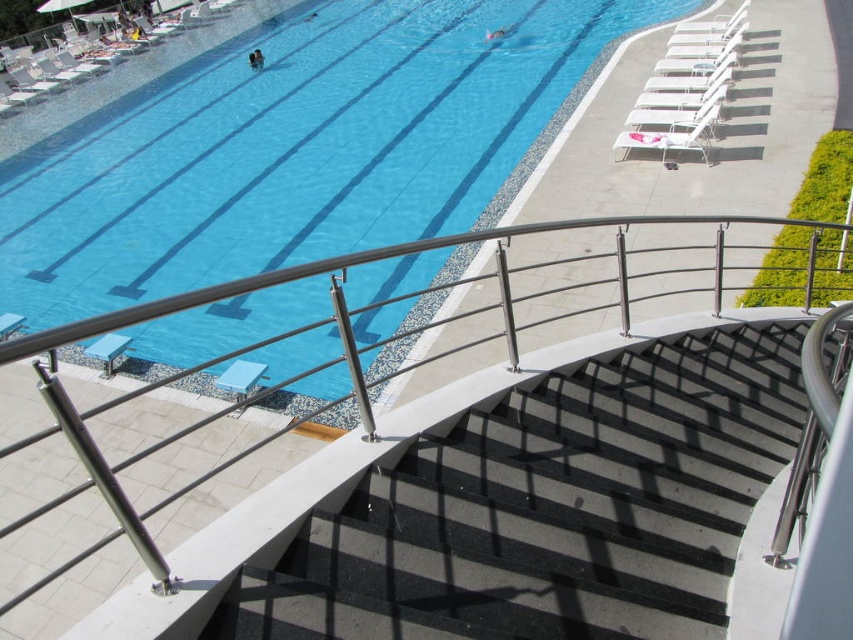
Question: Among these points, which one is farthest from the camera?

Choices:
 (A) (636, 106)
 (B) (358, 168)
 (C) (712, 394)

Answer: (B)

Question: Which point appears closest to the camera in this image?

Choices:
 (A) (637, 116)
 (B) (354, 202)

Answer: (B)

Question: Which of these objects is positioned farthest from the black textured stairs at center?

Choices:
 (A) white plastic lounge chair at upper right
 (B) blue glossy water at upper center

Answer: (A)

Question: Is black textured stairs at center above white plastic lounge chair at upper right?

Choices:
 (A) yes
 (B) no

Answer: (B)

Question: Can you confirm if blue glossy water at upper center is thinner than white plastic lounge chair at upper right?

Choices:
 (A) no
 (B) yes

Answer: (A)

Question: Does black textured stairs at center appear on the left side of white plastic lounge chair at upper right?

Choices:
 (A) yes
 (B) no

Answer: (A)